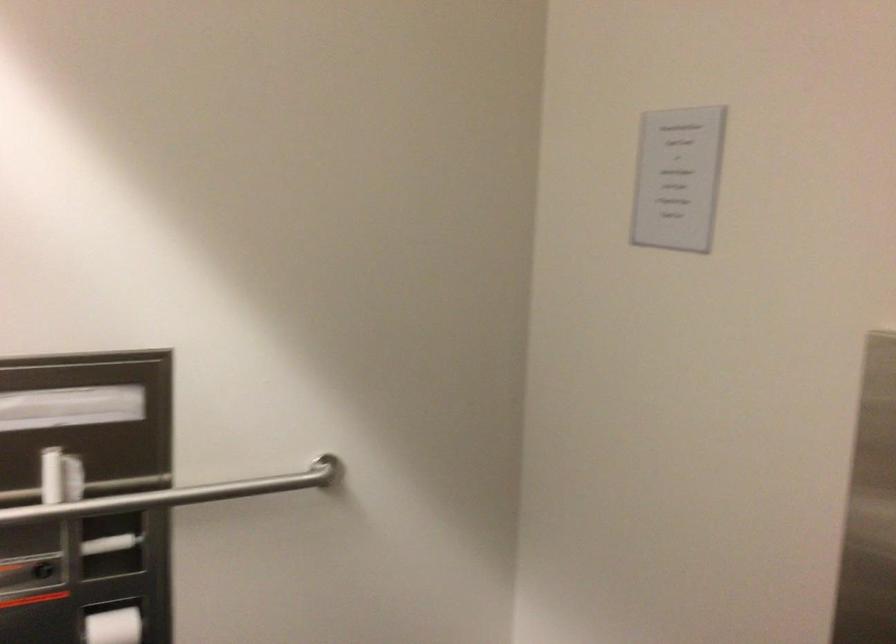
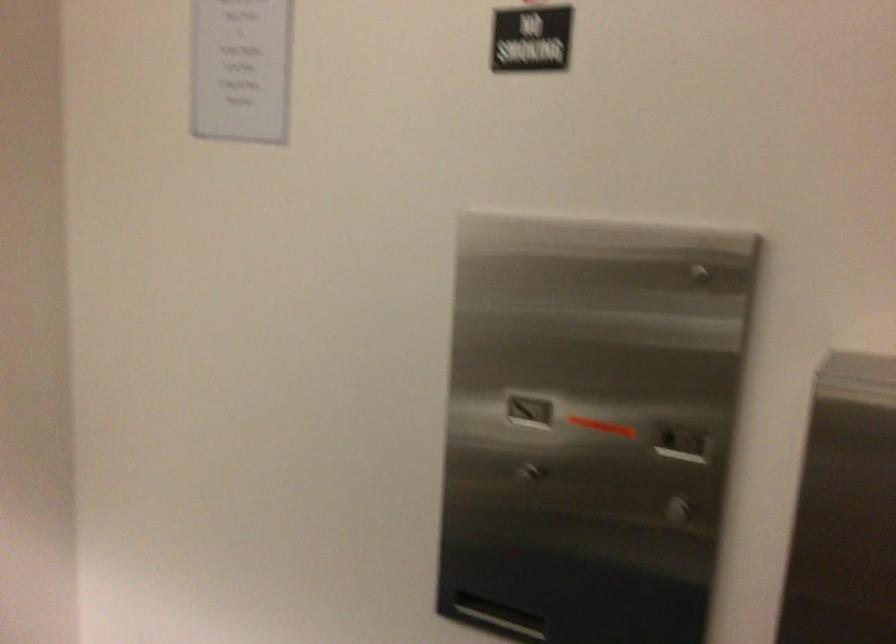
Question: Based on the continuous images, in which direction is the camera rotating? Reply with the corresponding letter.

Choices:
 (A) Left
 (B) Right
 (C) Up
 (D) Down

Answer: (B)